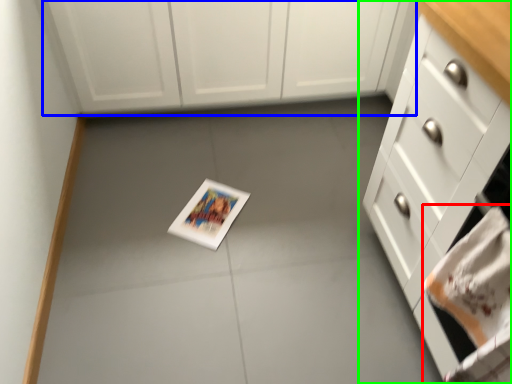
Question: Based on their relative distances, which object is nearer to hand towel (highlighted by a red box)? Choose from cabinetry (highlighted by a blue box) and cabinetry (highlighted by a green box).

Choices:
 (A) cabinetry
 (B) cabinetry

Answer: (B)